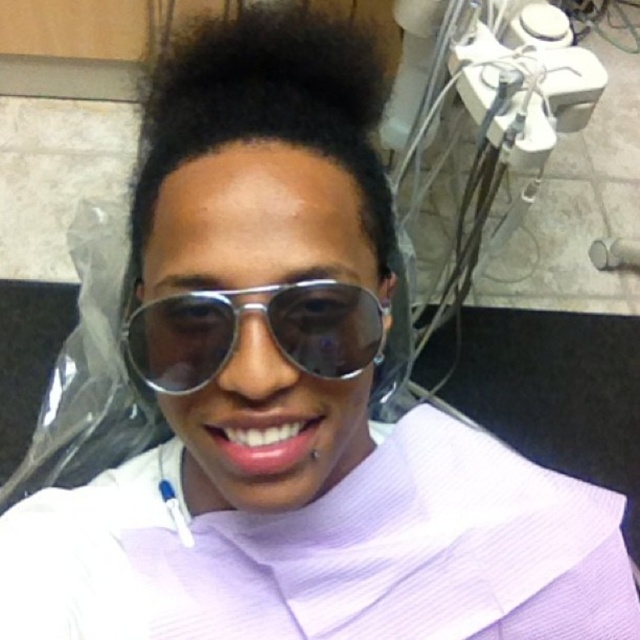
Looking at this image, which is more to the left, dark matte hair at upper center or metallic reflective goggles at center?

dark matte hair at upper center is more to the left.

Can you confirm if dark matte hair at upper center is bigger than metallic reflective goggles at center?

Indeed, dark matte hair at upper center has a larger size compared to metallic reflective goggles at center.

Find the location of a particular element. The image size is (640, 640). dark matte hair at upper center is located at coordinates (268, 106).